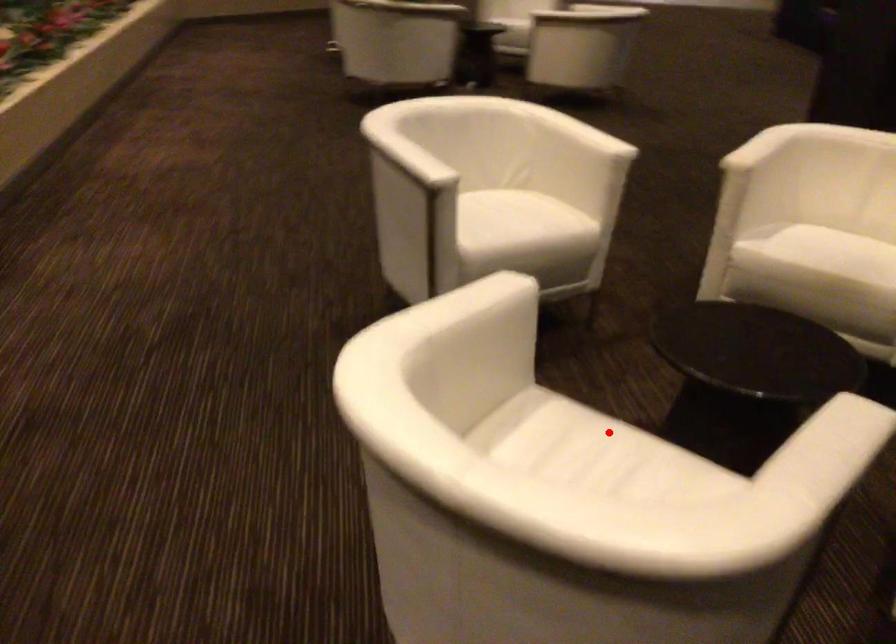
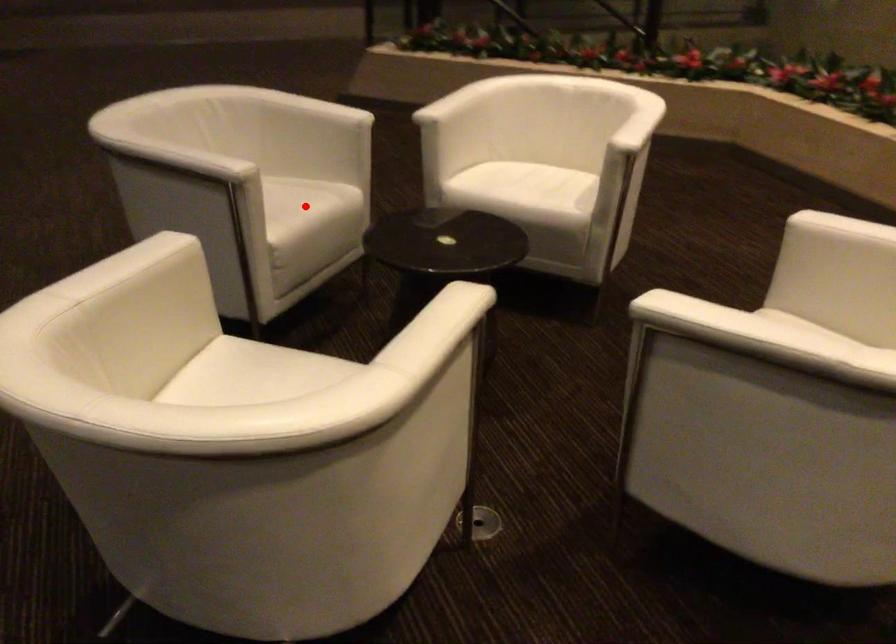
I am providing you with two images of the same scene from different viewpoints. A red point is marked on the first image and another point is marked on the second image. Is the marked point in image1 the same physical position as the marked point in image2?

No